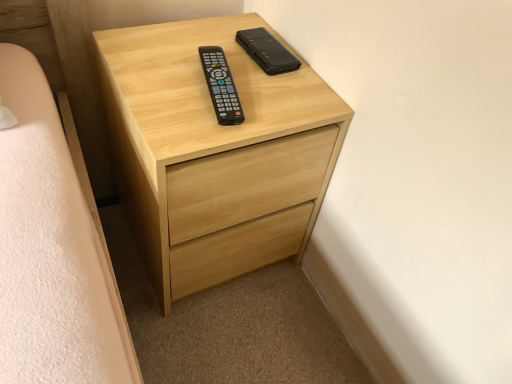
The image size is (512, 384). What are the coordinates of `free space above light wood chest of drawers at center (from a real-world perspective)` in the screenshot? It's located at (227, 73).